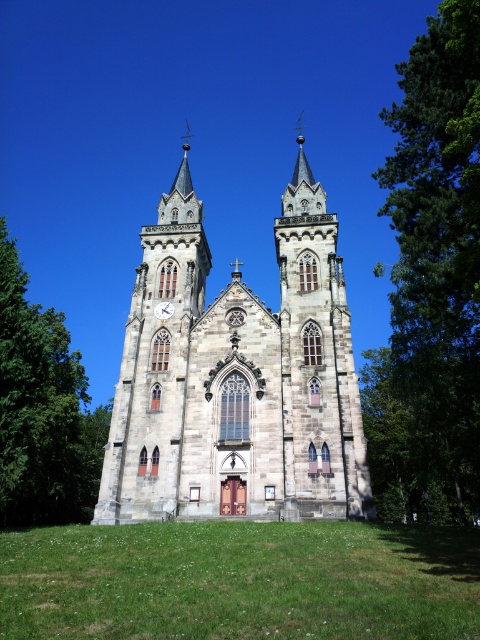
Question: Does green grass at lower center have a lesser width compared to white matte clock at center?

Choices:
 (A) yes
 (B) no

Answer: (B)

Question: Can you confirm if brown stone church at center is smaller than green grass at lower center?

Choices:
 (A) no
 (B) yes

Answer: (A)

Question: Which of the following is the farthest from the observer?

Choices:
 (A) green leafy tree at right
 (B) white matte clock at center

Answer: (B)

Question: Which point appears closest to the camera in this image?

Choices:
 (A) (440, 147)
 (B) (165, 301)

Answer: (A)

Question: Which point is farther to the camera?

Choices:
 (A) (260, 637)
 (B) (436, 256)
 (C) (63, 378)

Answer: (C)

Question: Considering the relative positions of brown stone church at center and green leafy tree at right in the image provided, where is brown stone church at center located with respect to green leafy tree at right?

Choices:
 (A) above
 (B) below

Answer: (B)